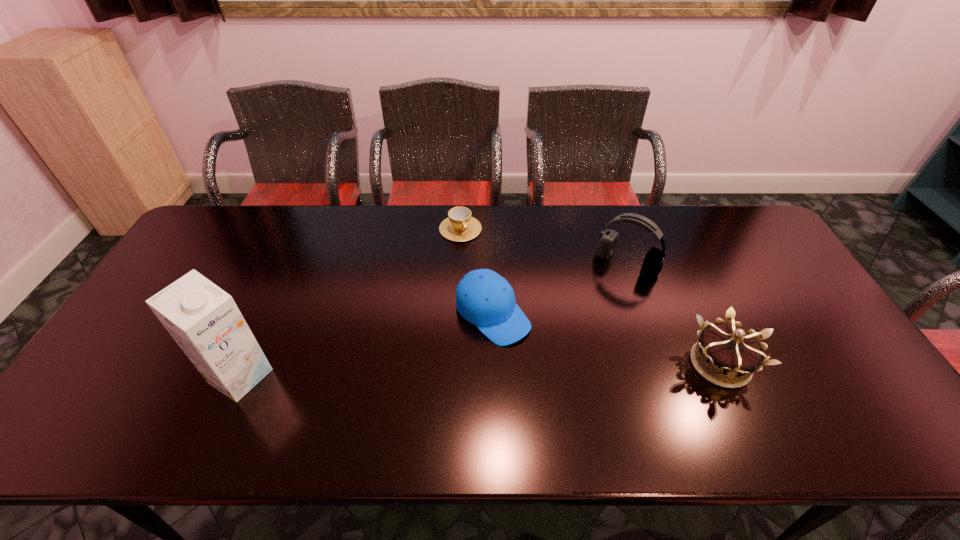
Where is `vacant space that satisfies the following two spatial constraints: 1. on the front side of the cup; 2. on the left side of the fourth tallest object`? The width and height of the screenshot is (960, 540). vacant space that satisfies the following two spatial constraints: 1. on the front side of the cup; 2. on the left side of the fourth tallest object is located at coordinates (456, 314).

Find the location of a particular element. free location that satisfies the following two spatial constraints: 1. on the front side of the shortest object; 2. on the right side of the cap is located at coordinates (456, 314).